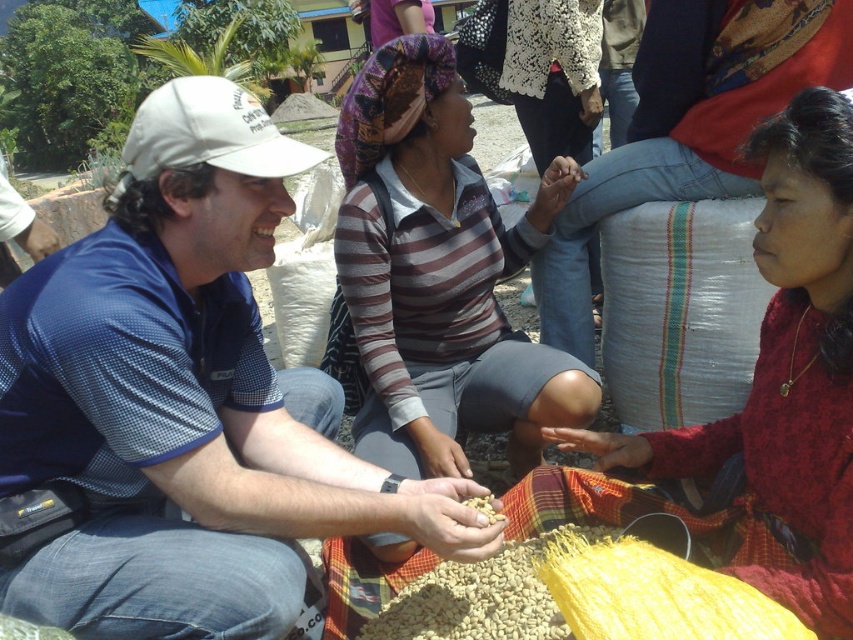
Question: Does red woven skirt at lower right have a greater width compared to brown matte beans at center?

Choices:
 (A) yes
 (B) no

Answer: (A)

Question: Which of the following is the farthest from the observer?

Choices:
 (A) (573, 406)
 (B) (305, 163)
 (C) (476, 508)
 (D) (836, 234)

Answer: (A)

Question: Is blue mesh shirt at center closer to camera compared to brown matte beans at center?

Choices:
 (A) no
 (B) yes

Answer: (B)

Question: Which object is positioned closest to the brown matte beans at center?

Choices:
 (A) blue mesh shirt at center
 (B) red woven skirt at lower right

Answer: (A)

Question: Among these points, which one is farthest from the camera?

Choices:
 (A) (497, 515)
 (B) (148, 147)

Answer: (A)

Question: Does red woven skirt at lower right have a lesser width compared to brown matte beans at center?

Choices:
 (A) yes
 (B) no

Answer: (B)